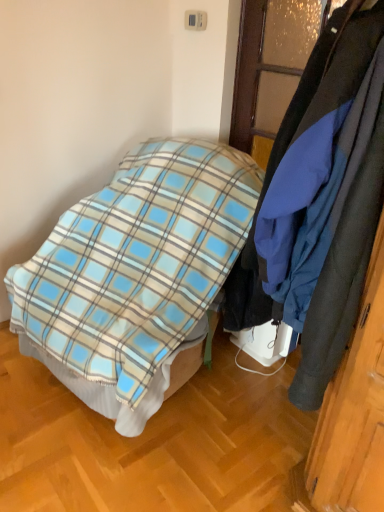
Question: In the image, is dark blue fabric coat at right on the left side or the right side of blue plaid blanket at center?

Choices:
 (A) left
 (B) right

Answer: (B)

Question: From a real-world perspective, relative to blue plaid blanket at center, is dark blue fabric coat at right vertically above or below?

Choices:
 (A) below
 (B) above

Answer: (B)

Question: From the image's perspective, is dark blue fabric coat at right positioned above or below blue plaid blanket at center?

Choices:
 (A) below
 (B) above

Answer: (B)

Question: From the image's perspective, is blue plaid blanket at center located above or below dark blue fabric coat at right?

Choices:
 (A) below
 (B) above

Answer: (A)

Question: In terms of width, does blue plaid blanket at center look wider or thinner when compared to dark blue fabric coat at right?

Choices:
 (A) thin
 (B) wide

Answer: (B)

Question: Is blue plaid blanket at center to the left or to the right of dark blue fabric coat at right in the image?

Choices:
 (A) left
 (B) right

Answer: (A)

Question: Considering the positions of blue plaid blanket at center and dark blue fabric coat at right in the image, is blue plaid blanket at center bigger or smaller than dark blue fabric coat at right?

Choices:
 (A) small
 (B) big

Answer: (B)